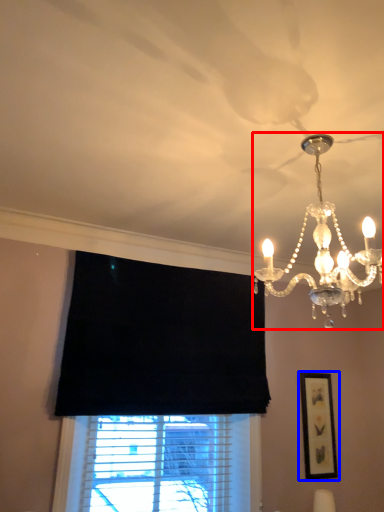
Question: Which point is further to the camera, lamp (highlighted by a red box) or picture frame (highlighted by a blue box)?

Choices:
 (A) lamp
 (B) picture frame

Answer: (B)